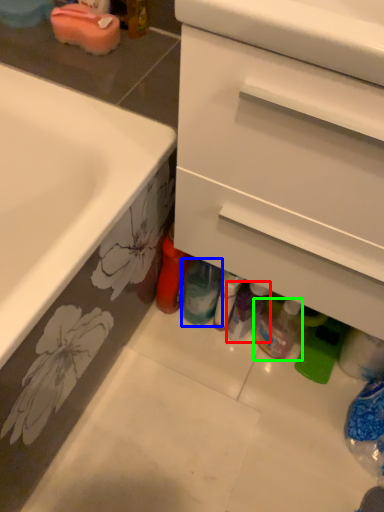
Question: Which object is positioned farthest from toiletry (highlighted by a red box)? Select from bottle (highlighted by a blue box) and bottle (highlighted by a green box).

Choices:
 (A) bottle
 (B) bottle

Answer: (A)